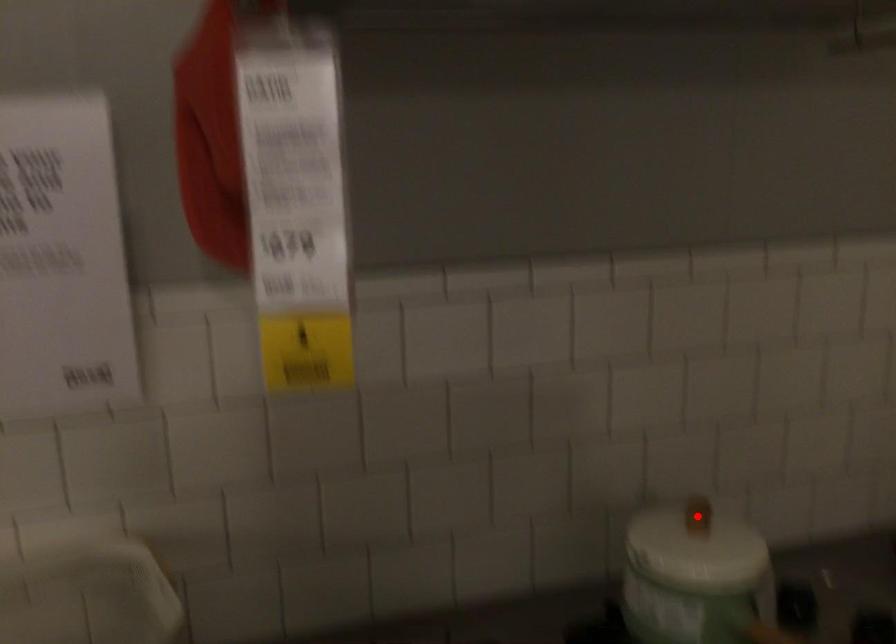
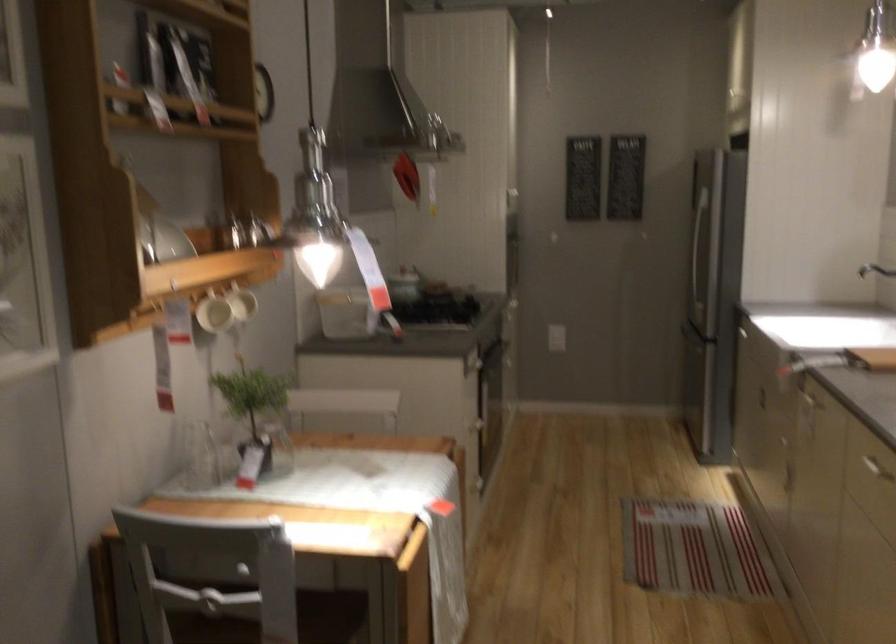
Question: I am providing you with two images of the same scene from different viewpoints. A red point is marked on the first image. Can you still see the location of the red point in image 2?

Choices:
 (A) Yes
 (B) No

Answer: (B)